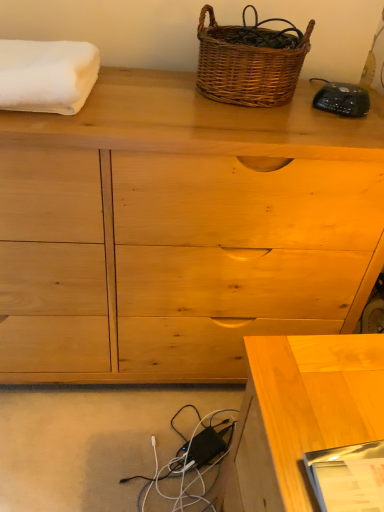
I want to click on vacant space that's between white fluffy towel at upper left and black plastic remote at upper right, so click(x=169, y=102).